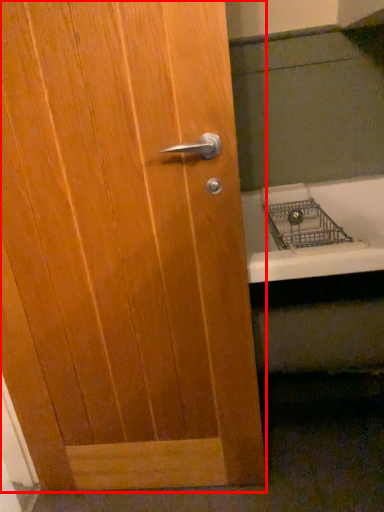
Question: Considering the relative positions of door (annotated by the red box) and bath in the image provided, where is door (annotated by the red box) located with respect to the staircase?

Choices:
 (A) right
 (B) left

Answer: (B)